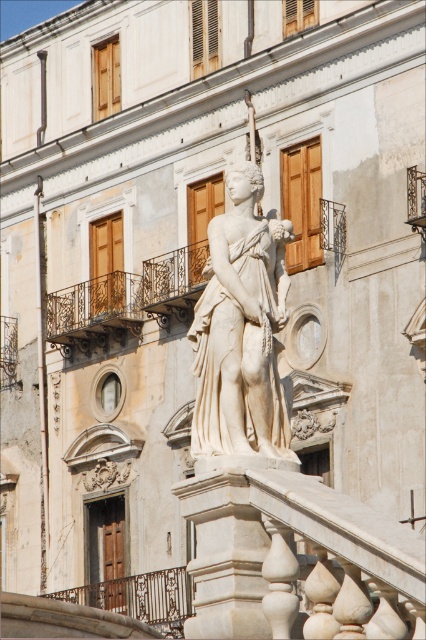
You are standing at the entrance of the building and want to place a small flower pot at the point marked by coordinates point (241,330). Is this point on the white marble statue at center?

Yes, the point (241,330) is on the white marble statue at center, so placing the flower pot there would be appropriate.

You are an art student who wants to sketch the white marble statue at center and the dark brown wrought iron balustrade at center. Which object should you focus on first if you want to capture the most prominent feature of the scene?

The white marble statue at center has a larger size compared to the dark brown wrought iron balustrade at center, so you should focus on the white marble statue at center first as it is the most prominent feature in the scene.